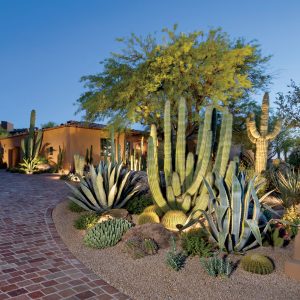
You are a GUI agent. You are given a task and a screenshot of the screen. Output one action in this format:
    pyautogui.click(x=<x>, y=<y>)
    Task: Click on the chimney
    The image size is (300, 300).
    Given the screenshot: What is the action you would take?
    pyautogui.click(x=6, y=124)